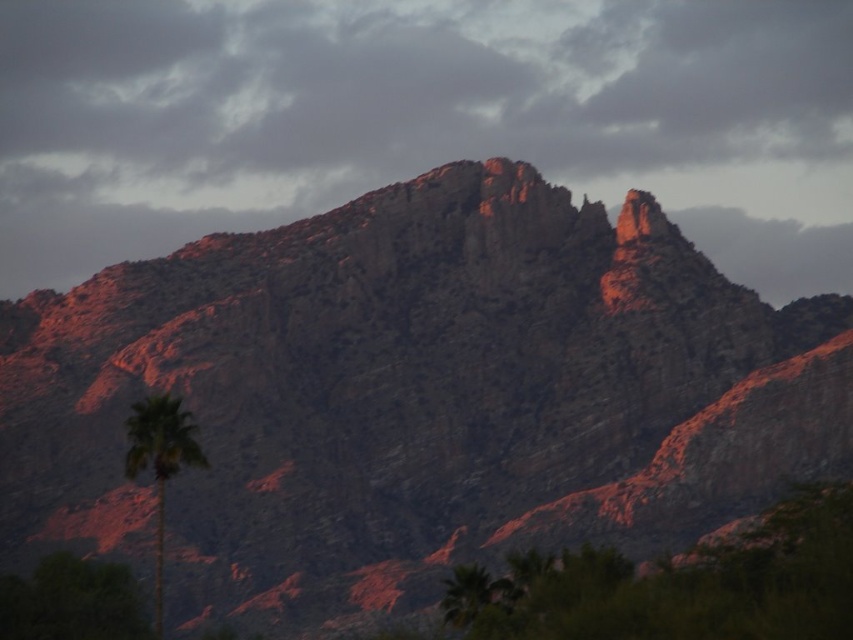
Can you confirm if smokey gray cloud at upper center is thinner than green leafy palm at lower left?

In fact, smokey gray cloud at upper center might be wider than green leafy palm at lower left.

Is point (144, 125) positioned after point (173, 404)?

Yes, it is behind point (173, 404).

You are a GUI agent. You are given a task and a screenshot of the screen. Output one action in this format:
    pyautogui.click(x=<x>, y=<y>)
    Task: Click on the smokey gray cloud at upper center
    Image resolution: width=853 pixels, height=640 pixels.
    Given the screenshot: What is the action you would take?
    pyautogui.click(x=421, y=120)